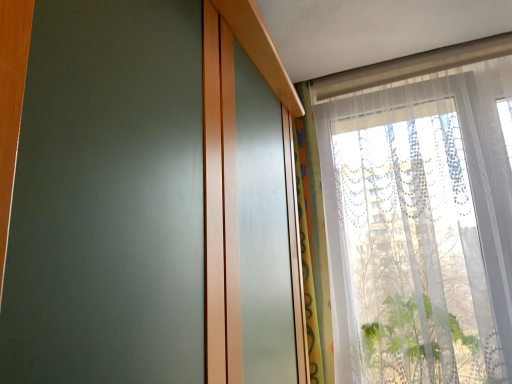
Question: From the image's perspective, is translucent fabric curtain at upper right positioned above or below transparent lace curtain at upper right?

Choices:
 (A) above
 (B) below

Answer: (B)

Question: Considering their positions, is translucent fabric curtain at upper right located in front of or behind transparent lace curtain at upper right?

Choices:
 (A) behind
 (B) front

Answer: (A)

Question: Is translucent fabric curtain at upper right inside the boundaries of transparent lace curtain at upper right, or outside?

Choices:
 (A) outside
 (B) inside

Answer: (A)

Question: Considering the positions of point click(370, 299) and point click(301, 100), is point click(370, 299) closer or farther from the camera than point click(301, 100)?

Choices:
 (A) closer
 (B) farther

Answer: (B)

Question: Relative to translucent fabric curtain at upper right, is transparent lace curtain at upper right in front or behind?

Choices:
 (A) behind
 (B) front

Answer: (B)

Question: Considering the relative positions of transparent lace curtain at upper right and translucent fabric curtain at upper right in the image provided, is transparent lace curtain at upper right to the left or to the right of translucent fabric curtain at upper right?

Choices:
 (A) right
 (B) left

Answer: (A)

Question: In terms of size, does transparent lace curtain at upper right appear bigger or smaller than translucent fabric curtain at upper right?

Choices:
 (A) small
 (B) big

Answer: (B)